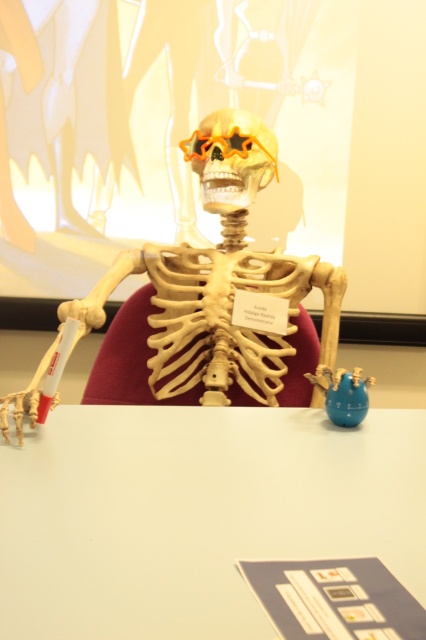
You are a student observing the skeleton model and the table. Which object is wider, the white matte table at center or the orange plastic skull at center?

The white matte table at center is wider than the orange plastic skull at center according to the description.

You are an assistant in a science museum and need to place a 36 inch long ruler between the white matte table at center and the orange plastic skull at center. Can the ruler fit between them without bending?

The distance between the white matte table at center and the orange plastic skull at center is 35.10 inches. Since the ruler is 36 inches long, it cannot fit between them without bending.

You are a student observing the skeleton model in the image. The teacher asks you to compare the height of the white matte table at center and the orange plastic skull at center. Which one is taller?

The orange plastic skull at center is taller than the white matte table at center because the table is not as tall as the skull.